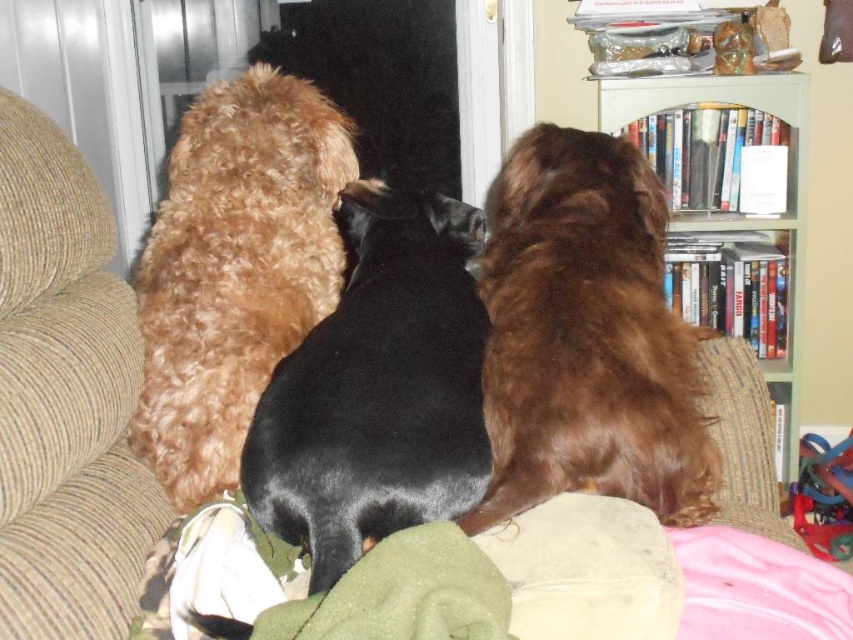
Question: Where is beige corduroy couch at left located in relation to shaggy golden-brown dog at center in the image?

Choices:
 (A) left
 (B) right

Answer: (A)

Question: Is black shiny dog at center to the right of shaggy golden-brown dog at center from the viewer's perspective?

Choices:
 (A) yes
 (B) no

Answer: (A)

Question: Which point is closer to the camera taking this photo?

Choices:
 (A) (734, 80)
 (B) (471, 276)
 (C) (595, 358)

Answer: (C)

Question: Among these points, which one is farthest from the camera?

Choices:
 (A) (102, 356)
 (B) (410, 282)

Answer: (B)

Question: Is brown fluffy dog at right positioned behind black shiny dog at center?

Choices:
 (A) no
 (B) yes

Answer: (B)

Question: Which object appears farthest from the camera in this image?

Choices:
 (A) shaggy golden-brown dog at center
 (B) brown fluffy dog at right
 (C) green painted wood bookshelf at upper right

Answer: (C)